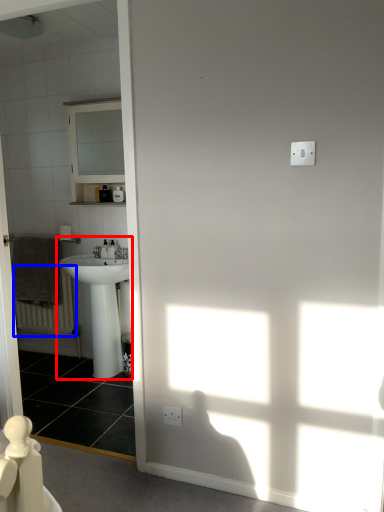
Question: Which point is closer to the camera, sink (highlighted by a red box) or radiator (highlighted by a blue box)?

Choices:
 (A) sink
 (B) radiator

Answer: (A)